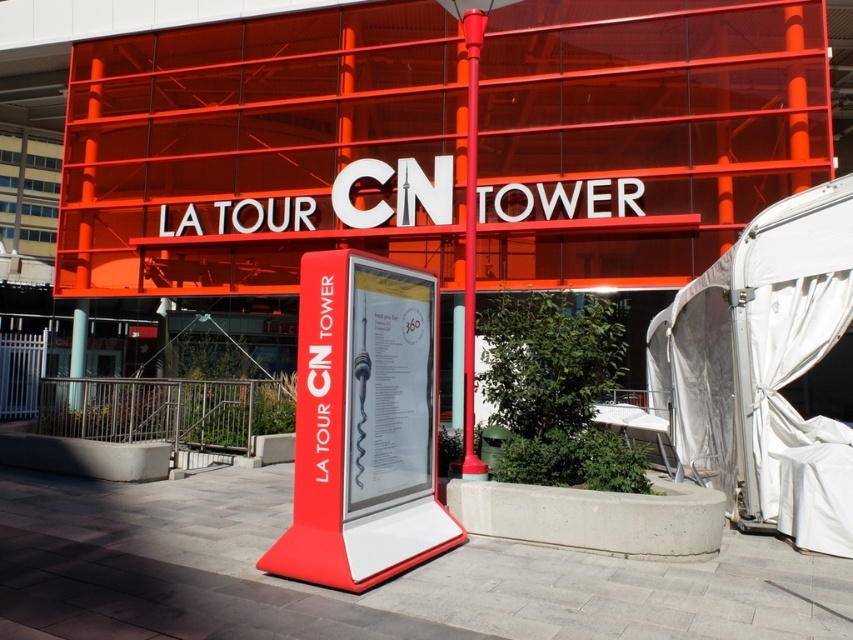
Who is more forward, (717,422) or (315,323)?

Point (315,323) is in front.

Does white fabric tent at right lie in front of matte red sign at center?

No, it is not.

Describe the element at coordinates (764, 369) in the screenshot. I see `white fabric tent at right` at that location.

Locate an element on the screen. The width and height of the screenshot is (853, 640). white fabric tent at right is located at coordinates (764, 369).

Which is in front, point (805, 371) or point (474, 36)?

Point (805, 371) is in front.

Which is more to the right, white fabric tent at right or shiny red pole at center?

Positioned to the right is white fabric tent at right.

Locate an element on the screen. The image size is (853, 640). white fabric tent at right is located at coordinates (764, 369).

Based on the photo, between matte red sign at center and shiny red pole at center, which one is positioned higher?

Positioned higher is shiny red pole at center.

Where is `matte red sign at center`? The image size is (853, 640). matte red sign at center is located at coordinates (363, 426).

The width and height of the screenshot is (853, 640). I want to click on matte red sign at center, so click(x=363, y=426).